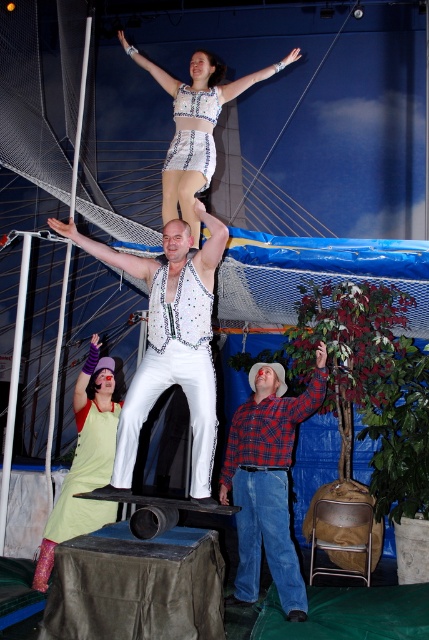
Question: Among these objects, which one is nearest to the camera?

Choices:
 (A) matte silver arm at upper center
 (B) white fabric arm at upper center
 (C) plaid flannel shirt at center
 (D) white sequined vest at center

Answer: (D)

Question: Does light green fabric dress at center have a lesser width compared to matte silver arm at upper center?

Choices:
 (A) no
 (B) yes

Answer: (A)

Question: Can you confirm if light green fabric dress at center is wider than shiny silver dress at upper center?

Choices:
 (A) no
 (B) yes

Answer: (B)

Question: Which point is farther from the camera taking this photo?

Choices:
 (A) (x=169, y=172)
 (B) (x=135, y=51)
 (C) (x=60, y=504)

Answer: (A)

Question: Which of the following is the closest to the observer?

Choices:
 (A) (163, 209)
 (B) (257, 532)
 (C) (205, 352)
 (D) (84, 248)

Answer: (C)

Question: Does shiny silver dress at upper center have a greater width compared to matte silver arm at upper center?

Choices:
 (A) yes
 (B) no

Answer: (A)